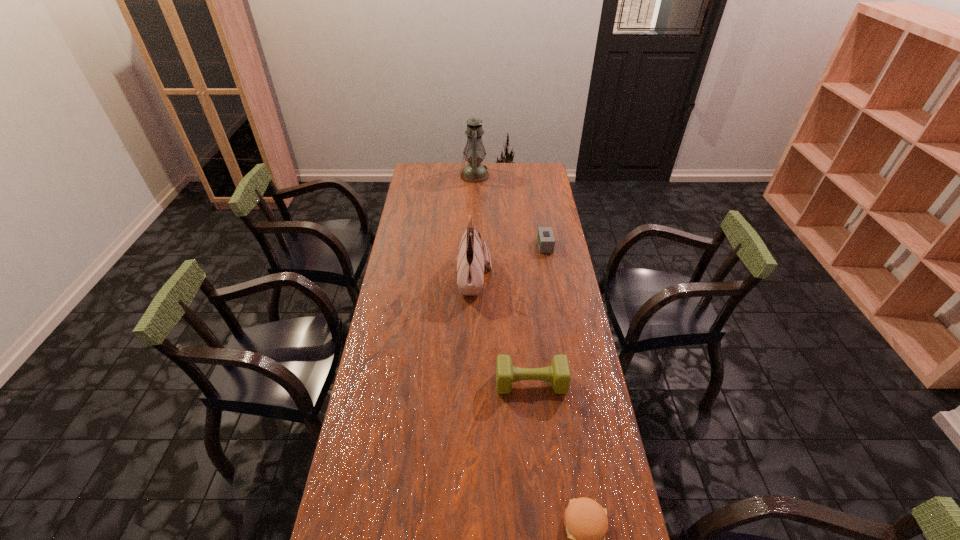
At what (x,y) coordinates should I click in order to perform the action: click on oil lamp. Please return your answer as a coordinate pair (x, y). This screenshot has height=540, width=960. Looking at the image, I should click on (474, 172).

Locate an element on the screen. This screenshot has height=540, width=960. handbag is located at coordinates (470, 265).

Find the location of a particular element. the fourth farthest object is located at coordinates 558,373.

Image resolution: width=960 pixels, height=540 pixels. Identify the location of dumbbell. (558, 373).

Locate an element on the screen. The width and height of the screenshot is (960, 540). the fourth tallest object is located at coordinates (546, 241).

Find the location of a particular element. free space located on the right of the farthest object is located at coordinates (522, 175).

Identify the location of free space located 0.280m on the side of the handbag with the attached pouch. The height and width of the screenshot is (540, 960). (560, 277).

Locate an element on the screen. This screenshot has height=540, width=960. vacant area situated on the front of the third shortest object is located at coordinates (542, 496).

Where is `vacant region located 0.360m on the front-facing side of the second shortest object`? vacant region located 0.360m on the front-facing side of the second shortest object is located at coordinates (458, 246).

This screenshot has width=960, height=540. I want to click on free space located 0.130m on the front-facing side of the second shortest object, so click(509, 246).